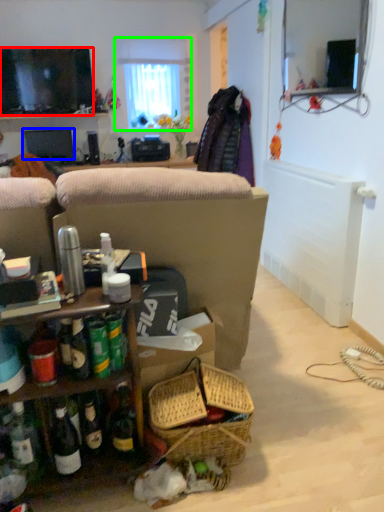
Question: Based on their relative distances, which object is farther from television (highlighted by a red box)? Choose from television (highlighted by a blue box) and window (highlighted by a green box).

Choices:
 (A) television
 (B) window

Answer: (B)